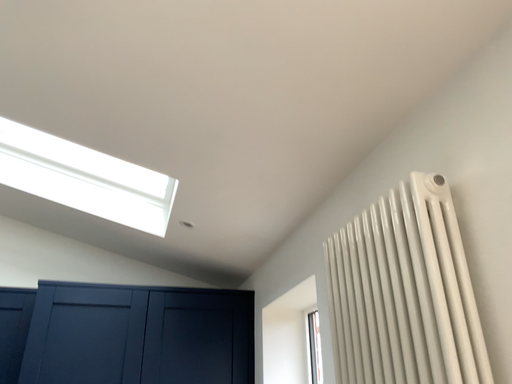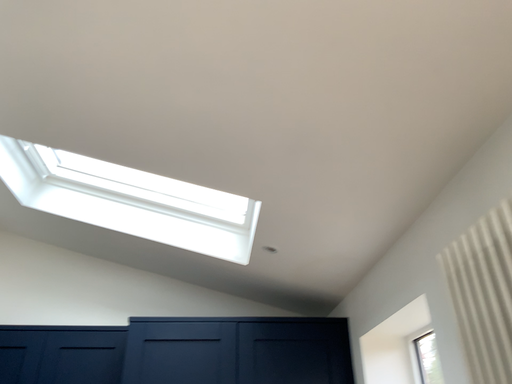
Question: Which way did the camera rotate in the video?

Choices:
 (A) rotated left
 (B) rotated right

Answer: (A)